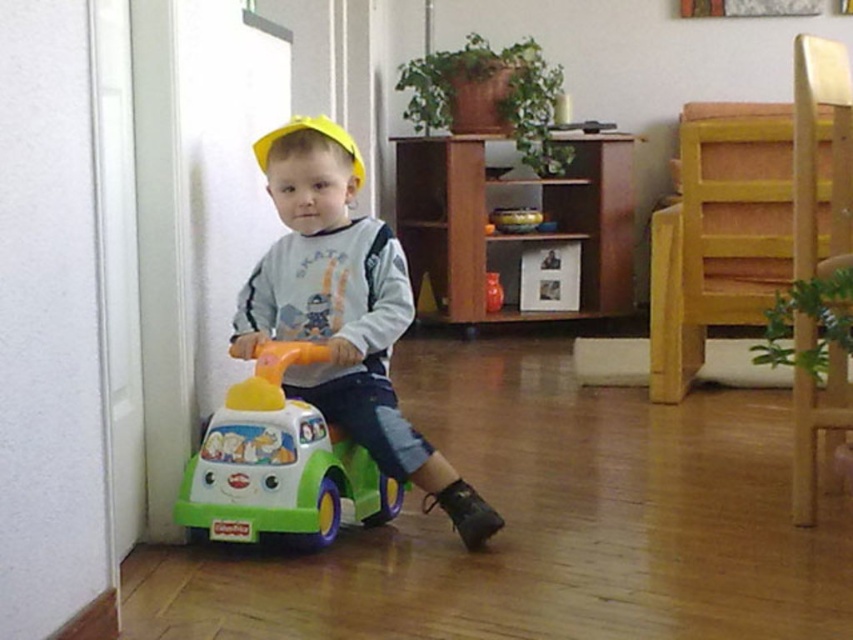
You are standing in the room and want to reach the point marked as point (335, 428). If you can move 3 feet per second, how many seconds will it take you to reach there?

The point (335, 428) is 5.55 feet away from the camera. Since you can move at 3 feet per second, it will take approximately 1.85 seconds to reach the point.

You are a parent trying to organize your childroom. You have a toy box that is 10 inches wide. You see the matte plastic toy car at center and the green plastic car at lower left. Can both of them fit side by side in the toy box?

The distance between the matte plastic toy car at center and the green plastic car at lower left is 6.63 inches. Since the toy box is 10 inches wide, which is wider than the combined space needed, both can fit side by side.

You are a parent trying to store the matte plastic toy car at center and the yellow matte hat at center in a small drawer. Which item will you place first to ensure both fit?

The yellow matte hat at center should be placed first in the drawer since the matte plastic toy car at center is bigger and needs more space. This way, there will be enough room left for the larger toy car.